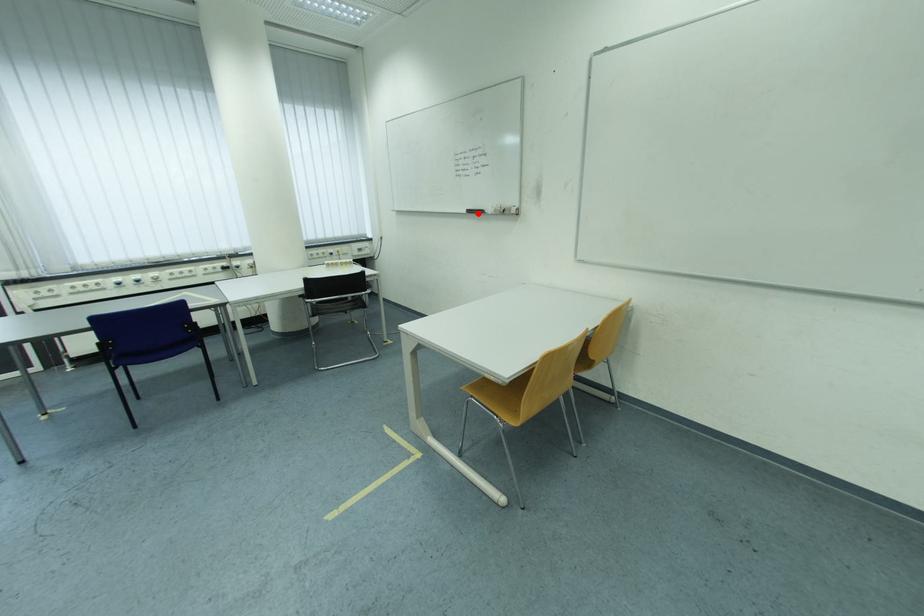
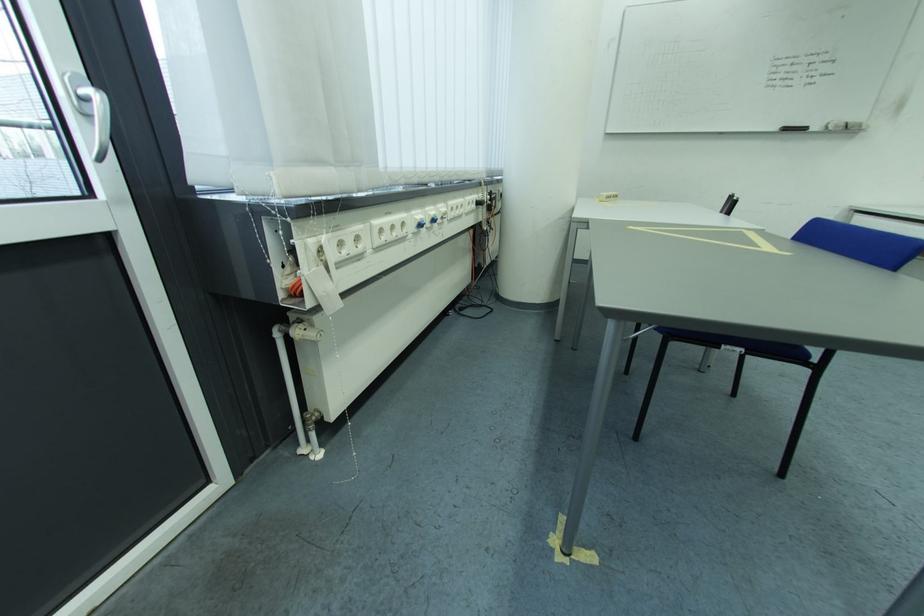
Question: I am providing you with two images of the same scene from different viewpoints. Given a red point in image1, look at the same physical point in image2. Is it:

Choices:
 (A) Closer to the viewpoint
 (B) Farther from the viewpoint

Answer: (B)